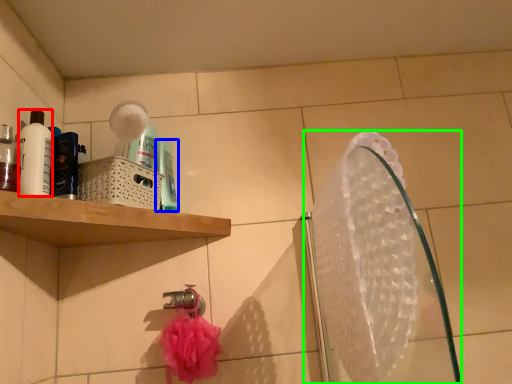
Question: Which is nearer to the mouthwash (highlighted by a red box)? mouthwash (highlighted by a blue box) or mirror (highlighted by a green box).

Choices:
 (A) mouthwash
 (B) mirror

Answer: (A)